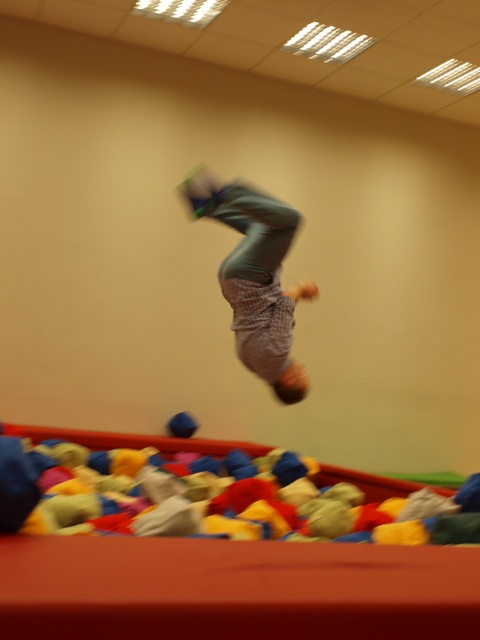
You are standing at the starting position and see two points marked in the image. Which point is closer to you, point (388, 531) or point (264, 326)?

Point (388, 531) is in front of point (264, 326), so it is closer to you.